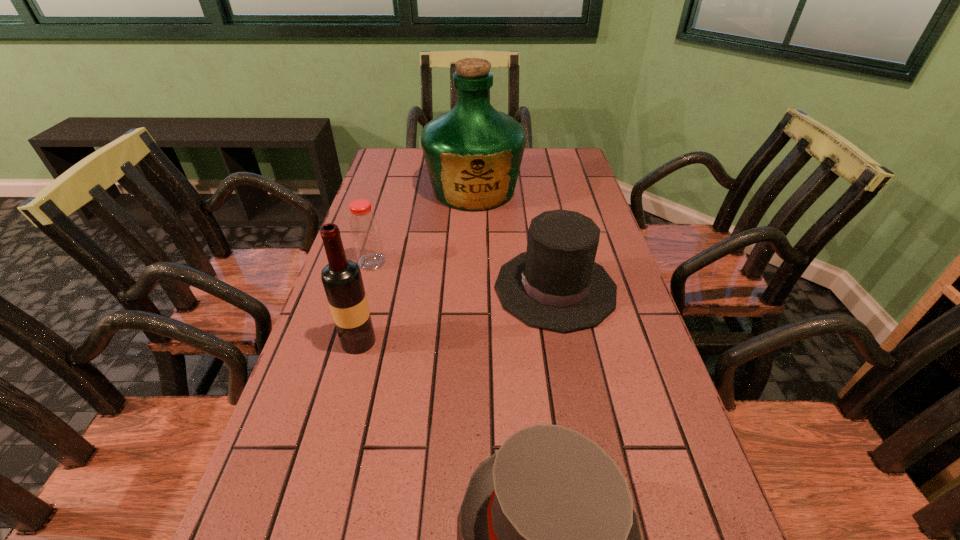
Find the location of `liquor`. liquor is located at coordinates (473, 153).

I want to click on the farthest object, so click(473, 153).

Locate an element on the screen. The image size is (960, 540). the fourth shortest object is located at coordinates (342, 280).

Where is `the farther dress hat`? Image resolution: width=960 pixels, height=540 pixels. the farther dress hat is located at coordinates (x=556, y=285).

Find the location of a particular element. bottle is located at coordinates (365, 232).

Image resolution: width=960 pixels, height=540 pixels. In order to click on vacant space located 0.280m on the label side of the liquor in this screenshot , I will do tap(472, 279).

Where is `free space located on the right of the wine bottle`? free space located on the right of the wine bottle is located at coordinates [449, 341].

This screenshot has height=540, width=960. In order to click on vacant space positioned 0.170m on the front of the farther dress hat with the decoration in this screenshot , I will do pos(425,288).

Find the location of a particular element. This screenshot has height=540, width=960. vacant space located on the front of the farther dress hat with the decoration is located at coordinates (449, 288).

Image resolution: width=960 pixels, height=540 pixels. I want to click on free spot located on the front of the farther dress hat with the decoration, so pyautogui.click(x=344, y=288).